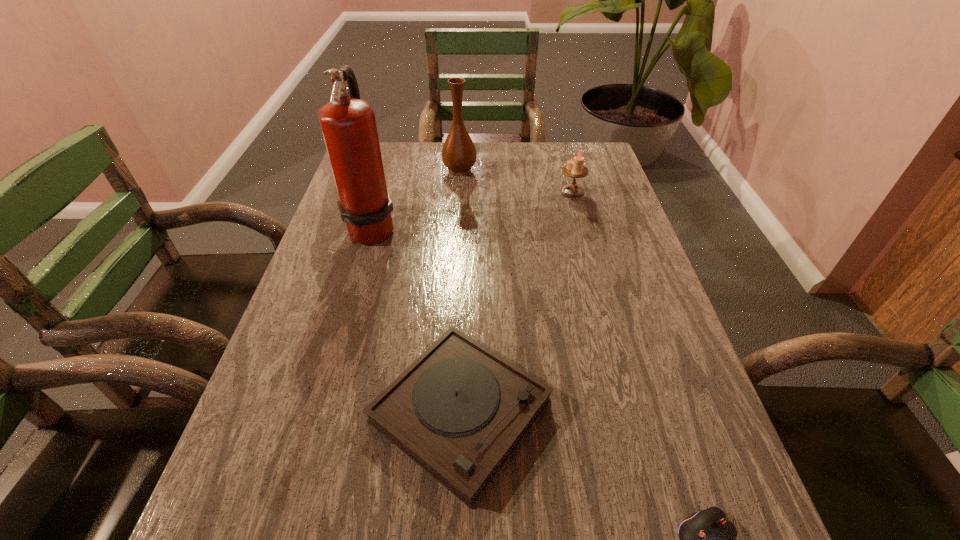
Locate an element on the screen. The height and width of the screenshot is (540, 960). free space between the candle holder and the fourth shortest object is located at coordinates (516, 180).

This screenshot has width=960, height=540. I want to click on free space between the third nearest object and the fourth farthest object, so click(x=417, y=319).

At what (x,y) coordinates should I click in order to perform the action: click on free space between the third farthest object and the second nearest object. Please return your answer as a coordinate pair (x, y). The width and height of the screenshot is (960, 540). Looking at the image, I should click on (417, 319).

Image resolution: width=960 pixels, height=540 pixels. I want to click on empty space that is in between the fourth nearest object and the fire extinguisher, so click(472, 209).

Identify the location of object that can be found as the second closest to the vase. Image resolution: width=960 pixels, height=540 pixels. (574, 168).

Where is `object that is the closest one to the fourth nearest object`? This screenshot has width=960, height=540. object that is the closest one to the fourth nearest object is located at coordinates (459, 154).

At what (x,y) coordinates should I click in order to perform the action: click on vacant region that satisfies the following two spatial constraints: 1. at the nozzle of the fire extinguisher; 2. on the left side of the phonograph record. Please return your answer as a coordinate pair (x, y). The image size is (960, 540). Looking at the image, I should click on (320, 411).

Find the location of `free point that satisfies the following two spatial constraints: 1. at the nozzle of the phonograph record; 2. on the right side of the fire extinguisher`. free point that satisfies the following two spatial constraints: 1. at the nozzle of the phonograph record; 2. on the right side of the fire extinguisher is located at coordinates (320, 411).

Locate an element on the screen. free spot that satisfies the following two spatial constraints: 1. at the nozzle of the third farthest object; 2. on the left side of the fourth farthest object is located at coordinates (320, 411).

The image size is (960, 540). In order to click on vacant area in the image that satisfies the following two spatial constraints: 1. on the front side of the second nearest object; 2. on the left side of the vase in this screenshot , I will do `click(444, 411)`.